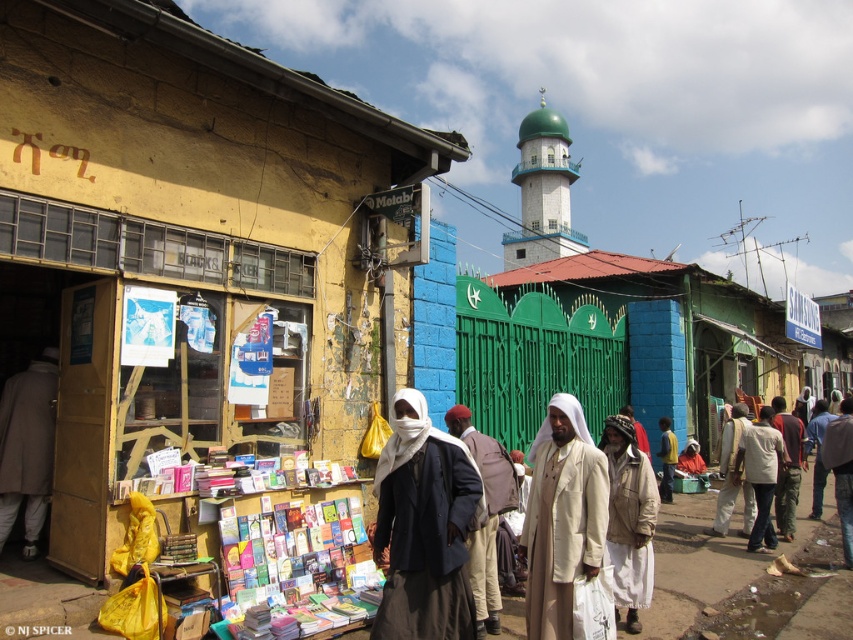
You are a photographer trying to capture both the white matte headscarf at center and the light beige fabric headscarf at center in a single frame. Since you want them both to be clearly visible, which headscarf should you focus on first to ensure depth of field? Please answer based on their positions.

The white matte headscarf at center is taller than the light beige fabric headscarf at center, so focusing on the white matte headscarf at center first would ensure both are in focus as it is further away.

From the picture: You are a delivery person trying to locate the shop named Metab. You see a white fabric headscarf at center and a bright green gate to the right. Which object is closer to the shop?

The white fabric headscarf at center is closer to the shop than the bright green gate to the right.